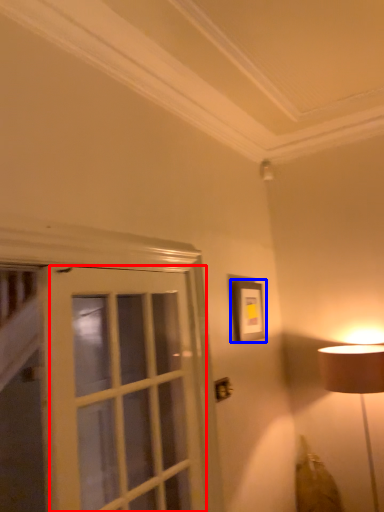
Question: Which object appears closest to the camera in this image, screen door (highlighted by a red box) or picture frame (highlighted by a blue box)?

Choices:
 (A) screen door
 (B) picture frame

Answer: (A)